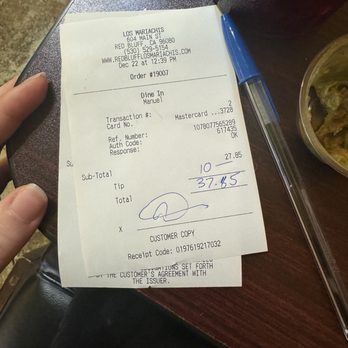
Identify the location of pen. The width and height of the screenshot is (348, 348). (x=278, y=147).